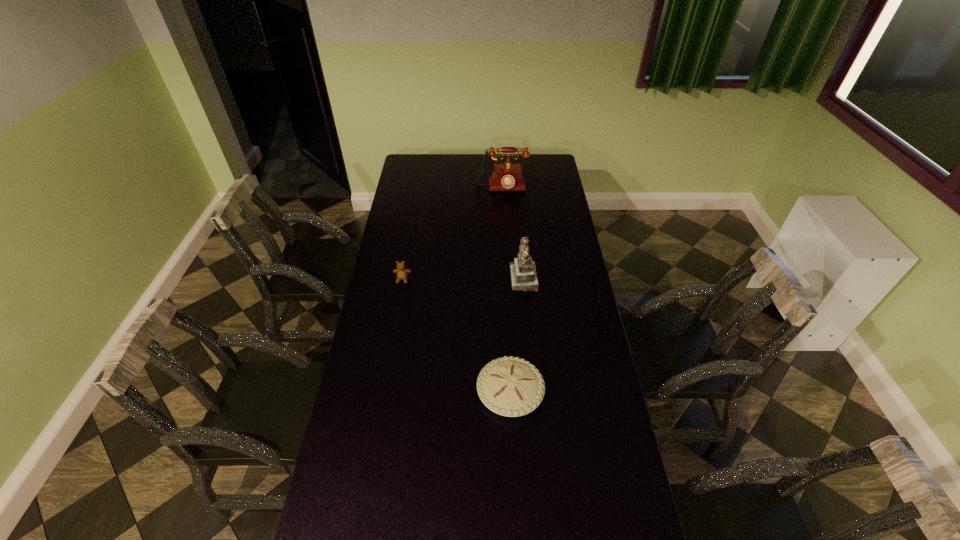
Image resolution: width=960 pixels, height=540 pixels. Identify the location of free space between the pie and the farthest object. (506, 291).

This screenshot has height=540, width=960. In order to click on the third closest object to the figurine in this screenshot , I will do `click(506, 177)`.

This screenshot has width=960, height=540. Identify the location of object that is the second nearest to the nearest object. 401,272.

The height and width of the screenshot is (540, 960). What are the coordinates of `blank area in the image that satisfies the following two spatial constraints: 1. on the front-facing side of the shortest object; 2. on the right side of the leftmost object` in the screenshot? It's located at (383, 393).

Locate an element on the screen. Image resolution: width=960 pixels, height=540 pixels. free location that satisfies the following two spatial constraints: 1. on the front-facing side of the figurine; 2. on the front-facing side of the leftmost object is located at coordinates (524, 279).

Locate an element on the screen. free space that satisfies the following two spatial constraints: 1. on the front-facing side of the figurine; 2. on the front-facing side of the leftmost object is located at coordinates tap(524, 279).